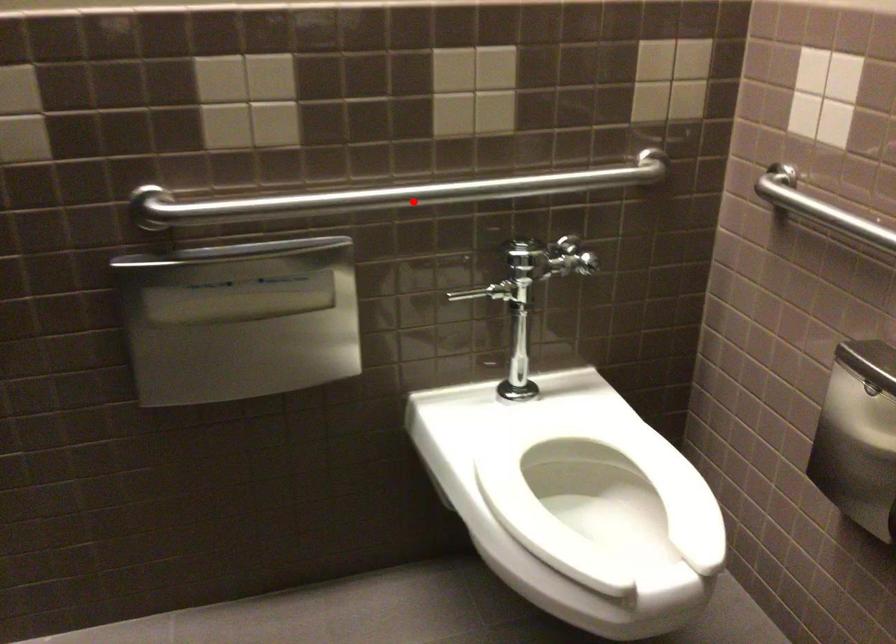
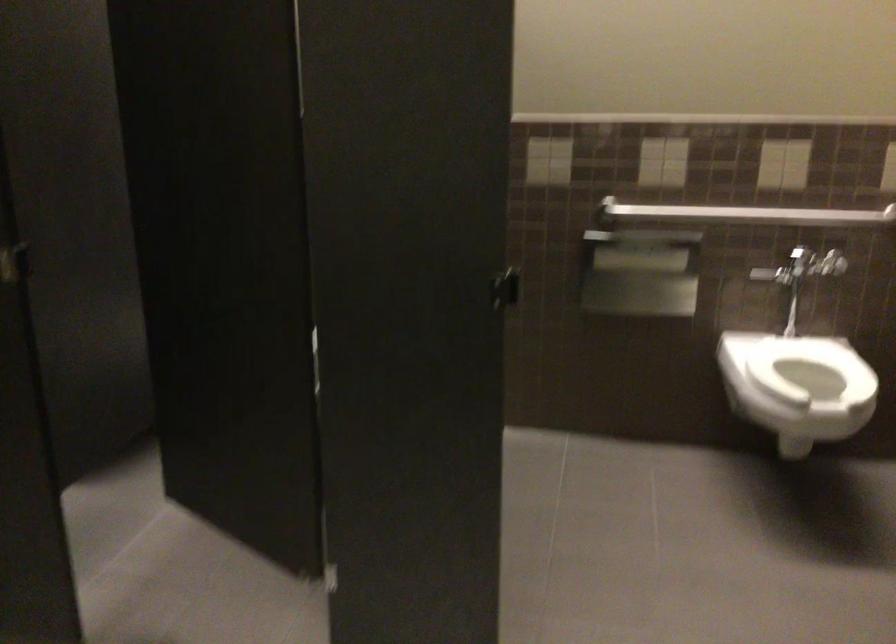
Question: I am providing you with two images of the same scene from different viewpoints. Given a red point in image1, look at the same physical point in image2. Is it:

Choices:
 (A) Closer to the viewpoint
 (B) Farther from the viewpoint

Answer: (B)